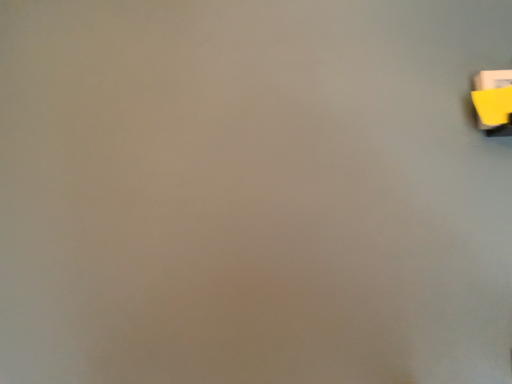
The width and height of the screenshot is (512, 384). I want to click on yellow matte eraser at upper right, so click(x=493, y=102).

Measure the distance between yellow matte eraser at upper right and camera.

yellow matte eraser at upper right is 82.20 centimeters from camera.

This screenshot has width=512, height=384. What do you see at coordinates (493, 102) in the screenshot?
I see `yellow matte eraser at upper right` at bounding box center [493, 102].

Locate an element on the screen. yellow matte eraser at upper right is located at coordinates (493, 102).